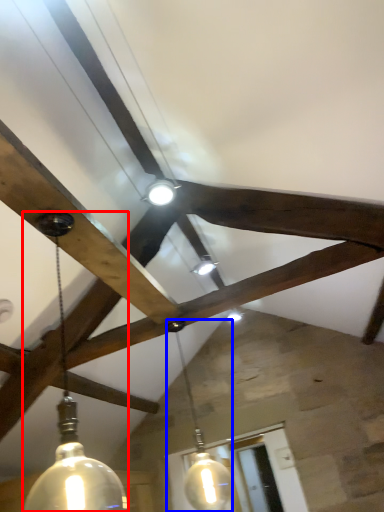
Question: Which of the following is the closest to the observer, lamp (highlighted by a red box) or lamp (highlighted by a blue box)?

Choices:
 (A) lamp
 (B) lamp

Answer: (A)